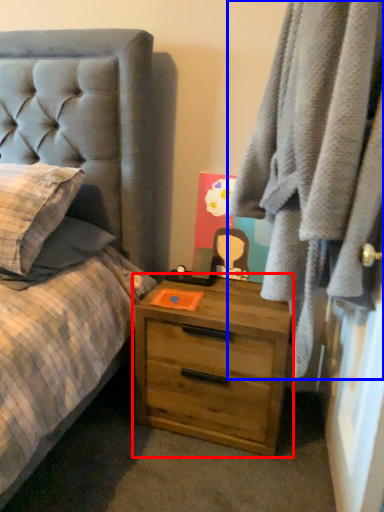
Question: Which object is further to the camera taking this photo, chest of drawers (highlighted by a red box) or clothing (highlighted by a blue box)?

Choices:
 (A) chest of drawers
 (B) clothing

Answer: (A)